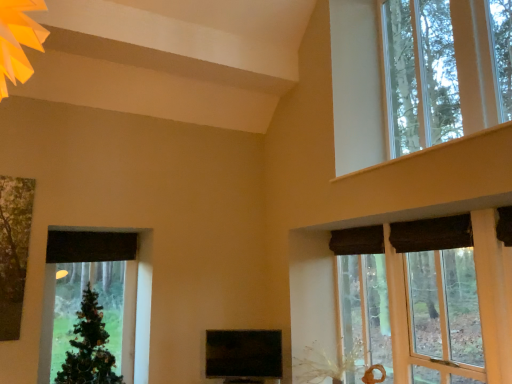
In order to face wooden window frame at upper right, which ranks as the 1th window in bottom-to-top order, should I rotate leftwards or rightwards?

To face it directly, rotate right by 19.876 degrees.

Measure the distance between matte black tv at center and camera.

matte black tv at center is 13.03 feet from camera.

Where is `wooden window frame at upper right, which is counted as the 2th window, starting from the top`? wooden window frame at upper right, which is counted as the 2th window, starting from the top is located at coordinates (313, 290).

Considering the positions of objects clear glass window at upper right, placed as the 2th window when sorted from bottom to top, and green matte christmas tree at left in the image provided, who is more to the left, clear glass window at upper right, placed as the 2th window when sorted from bottom to top, or green matte christmas tree at left?

Positioned to the left is green matte christmas tree at left.

From a real-world perspective, between clear glass window at upper right, placed as the 2th window when sorted from bottom to top, and green matte christmas tree at left, who is vertically higher?

clear glass window at upper right, placed as the 2th window when sorted from bottom to top.

Is point (468, 32) closer to camera compared to point (85, 369)?

Yes, point (468, 32) is in front of point (85, 369).

Consider the image. Is clear glass window at upper right, the first window when ordered from top to bottom, located outside green matte christmas tree at left?

Yes, clear glass window at upper right, the first window when ordered from top to bottom, is located beyond the bounds of green matte christmas tree at left.

Does matte black tv at center have a smaller size compared to wooden window frame at upper right, which is counted as the 2th window, starting from the top?

Correct, matte black tv at center occupies less space than wooden window frame at upper right, which is counted as the 2th window, starting from the top.

Between matte black tv at center and wooden window frame at upper right, which is counted as the 2th window, starting from the top, which one appears on the left side from the viewer's perspective?

Positioned to the left is matte black tv at center.

Does point (214, 365) appear closer or farther from the camera than point (306, 337)?

Point (214, 365) is closer to the camera than point (306, 337).

Is matte black tv at center oriented away from wooden window frame at upper right, which is counted as the 2th window, starting from the top?

No, matte black tv at center is not facing the opposite direction of wooden window frame at upper right, which is counted as the 2th window, starting from the top.

Are clear glass window at upper right, placed as the 2th window when sorted from bottom to top, and wooden window frame at upper right, which is counted as the 2th window, starting from the top, making contact?

clear glass window at upper right, placed as the 2th window when sorted from bottom to top, is not next to wooden window frame at upper right, which is counted as the 2th window, starting from the top, and they're not touching.

Is clear glass window at upper right, placed as the 2th window when sorted from bottom to top, in front of or behind wooden window frame at upper right, which ranks as the 1th window in bottom-to-top order, in the image?

clear glass window at upper right, placed as the 2th window when sorted from bottom to top, is behind wooden window frame at upper right, which ranks as the 1th window in bottom-to-top order.

Considering the sizes of objects clear glass window at upper right, placed as the 2th window when sorted from bottom to top, and wooden window frame at upper right, which ranks as the 1th window in bottom-to-top order, in the image provided, who is wider, clear glass window at upper right, placed as the 2th window when sorted from bottom to top, or wooden window frame at upper right, which ranks as the 1th window in bottom-to-top order,?

clear glass window at upper right, placed as the 2th window when sorted from bottom to top.

Is wooden window frame at upper right, which is counted as the 2th window, starting from the top, positioned behind clear glass window at upper right, placed as the 2th window when sorted from bottom to top?

No, wooden window frame at upper right, which is counted as the 2th window, starting from the top, is closer to the viewer.

How many degrees apart are the facing directions of wooden window frame at upper right, which ranks as the 1th window in bottom-to-top order, and clear glass window at upper right, placed as the 2th window when sorted from bottom to top?

wooden window frame at upper right, which ranks as the 1th window in bottom-to-top order, and clear glass window at upper right, placed as the 2th window when sorted from bottom to top, are facing 0.00108 degrees away from each other.

Is wooden window frame at upper right, which ranks as the 1th window in bottom-to-top order, with clear glass window at upper right, placed as the 2th window when sorted from bottom to top?

They are not placed beside each other.

Does wooden window frame at upper right, which ranks as the 1th window in bottom-to-top order, have a lesser height compared to clear glass window at upper right, the first window when ordered from top to bottom?

Correct, wooden window frame at upper right, which ranks as the 1th window in bottom-to-top order, is not as tall as clear glass window at upper right, the first window when ordered from top to bottom.

How different are the orientations of wooden window frame at upper right, which is counted as the 2th window, starting from the top, and green matte christmas tree at left in degrees?

The angular difference between wooden window frame at upper right, which is counted as the 2th window, starting from the top, and green matte christmas tree at left is 92.7 degrees.

Does wooden window frame at upper right, which ranks as the 1th window in bottom-to-top order, have a larger size compared to green matte christmas tree at left?

Correct, wooden window frame at upper right, which ranks as the 1th window in bottom-to-top order, is larger in size than green matte christmas tree at left.

Is wooden window frame at upper right, which ranks as the 1th window in bottom-to-top order, beside green matte christmas tree at left?

No, wooden window frame at upper right, which ranks as the 1th window in bottom-to-top order, is not next to green matte christmas tree at left.

From a real-world perspective, between wooden window frame at upper right, which is counted as the 2th window, starting from the top, and green matte christmas tree at left, who is vertically lower?

From a 3D spatial view, green matte christmas tree at left is below.

Is point (336, 227) more distant than point (271, 367)?

That is True.

Which of these two, wooden window frame at upper right, which is counted as the 2th window, starting from the top, or matte black tv at center, stands shorter?

matte black tv at center is shorter.

Choose the correct answer: Is wooden window frame at upper right, which is counted as the 2th window, starting from the top, inside matte black tv at center or outside it?

wooden window frame at upper right, which is counted as the 2th window, starting from the top, lies outside matte black tv at center.

In the scene shown: Is the surface of wooden window frame at upper right, which ranks as the 1th window in bottom-to-top order, in direct contact with matte black tv at center?

wooden window frame at upper right, which ranks as the 1th window in bottom-to-top order, is not next to matte black tv at center, and they're not touching.

From the image's perspective, relative to wooden window frame at upper right, which is counted as the 2th window, starting from the top, is green matte christmas tree at left above or below?

Clearly, from the image's perspective, green matte christmas tree at left is below wooden window frame at upper right, which is counted as the 2th window, starting from the top.

Starting from the green matte christmas tree at left, which window is the 1st one to the right? Please provide its 2D coordinates.

[(313, 290)]

Is green matte christmas tree at left taller than wooden window frame at upper right, which is counted as the 2th window, starting from the top?

In fact, green matte christmas tree at left may be shorter than wooden window frame at upper right, which is counted as the 2th window, starting from the top.

Is point (103, 352) closer or farther from the camera than point (320, 250)?

Point (103, 352) is positioned closer to the camera compared to point (320, 250).

From a real-world perspective, which window is the 2nd one above the green matte christmas tree at left? Please provide its 2D coordinates.

[(410, 77)]

Starting from the matte black tv at center, which window is the 2nd one in front? Please provide its 2D coordinates.

[(313, 290)]

From the image, which object appears to be farther from clear glass window at upper right, placed as the 2th window when sorted from bottom to top, matte black tv at center or wooden window frame at upper right, which ranks as the 1th window in bottom-to-top order?

matte black tv at center.

Which object lies nearer to the anchor point green matte christmas tree at left, wooden window frame at upper right, which is counted as the 2th window, starting from the top, or clear glass window at upper right, placed as the 2th window when sorted from bottom to top?

wooden window frame at upper right, which is counted as the 2th window, starting from the top, lies closer to green matte christmas tree at left than the other object.

From the image, which object appears to be nearer to wooden window frame at upper right, which is counted as the 2th window, starting from the top, clear glass window at upper right, the first window when ordered from top to bottom, or green matte christmas tree at left?

clear glass window at upper right, the first window when ordered from top to bottom.

Which object lies further to the anchor point green matte christmas tree at left, clear glass window at upper right, placed as the 2th window when sorted from bottom to top, or wooden window frame at upper right, which ranks as the 1th window in bottom-to-top order?

The object further to green matte christmas tree at left is clear glass window at upper right, placed as the 2th window when sorted from bottom to top.

From the image, which object appears to be farther from matte black tv at center, clear glass window at upper right, the first window when ordered from top to bottom, or green matte christmas tree at left?

Based on the image, clear glass window at upper right, the first window when ordered from top to bottom, appears to be further to matte black tv at center.

From the image, which object appears to be nearer to green matte christmas tree at left, wooden window frame at upper right, which is counted as the 2th window, starting from the top, or matte black tv at center?

matte black tv at center lies closer to green matte christmas tree at left than the other object.

When comparing their distances from wooden window frame at upper right, which is counted as the 2th window, starting from the top, does matte black tv at center or green matte christmas tree at left seem closer?

matte black tv at center is positioned closer to the anchor wooden window frame at upper right, which is counted as the 2th window, starting from the top.

Which object lies nearer to the anchor point matte black tv at center, clear glass window at upper right, placed as the 2th window when sorted from bottom to top, or wooden window frame at upper right, which is counted as the 2th window, starting from the top?

wooden window frame at upper right, which is counted as the 2th window, starting from the top, is closer to matte black tv at center.

Where is `window between clear glass window at upper right, placed as the 2th window when sorted from bottom to top, and matte black tv at center from top to bottom`? The height and width of the screenshot is (384, 512). window between clear glass window at upper right, placed as the 2th window when sorted from bottom to top, and matte black tv at center from top to bottom is located at coordinates (313, 290).

You are a GUI agent. You are given a task and a screenshot of the screen. Output one action in this format:
    pyautogui.click(x=<x>, y=<y>)
    Task: Click on the christmas tree that lies between clear glass window at upper right, the first window when ordered from top to bottom, and matte black tv at center from top to bottom
    Image resolution: width=512 pixels, height=384 pixels.
    Given the screenshot: What is the action you would take?
    pyautogui.click(x=89, y=347)

Where is `window screen between green matte christmas tree at left and wooden window frame at upper right, which ranks as the 1th window in bottom-to-top order, in the horizontal direction`? window screen between green matte christmas tree at left and wooden window frame at upper right, which ranks as the 1th window in bottom-to-top order, in the horizontal direction is located at coordinates (244, 356).

The width and height of the screenshot is (512, 384). In order to click on window between green matte christmas tree at left and clear glass window at upper right, the first window when ordered from top to bottom in this screenshot , I will do `click(313, 290)`.